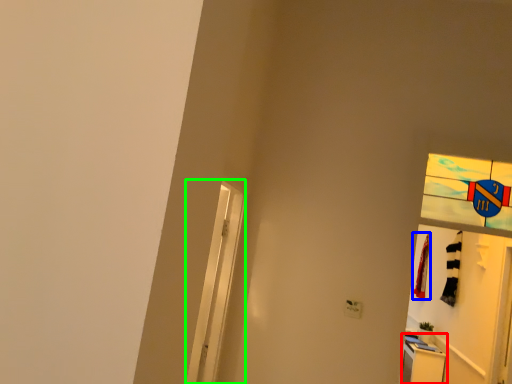
Question: Which object is the farthest from dresser (highlighted by a red box)? Choose among these: laundry (highlighted by a blue box) or screen door (highlighted by a green box).

Choices:
 (A) laundry
 (B) screen door

Answer: (B)